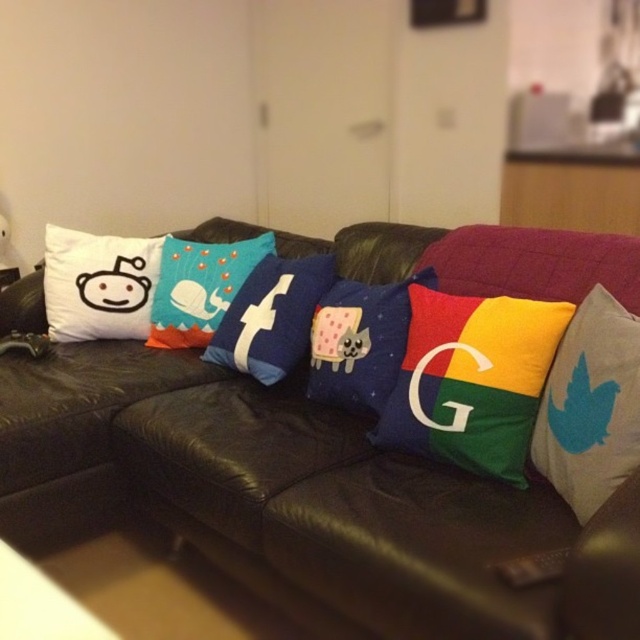
Question: Which of the following is the closest to the observer?

Choices:
 (A) (605, 390)
 (B) (298, 544)
 (C) (77, 316)

Answer: (A)

Question: Is white fabric twitter bird at right above velvet blue cushion with cartoon character at center?

Choices:
 (A) yes
 (B) no

Answer: (B)

Question: Which object is farther from the camera taking this photo?

Choices:
 (A) velvet blue cushion with cartoon character at center
 (B) white fabric pillow with reddit logo at left
 (C) teal fabric whale at center

Answer: (B)

Question: Which point is closer to the camera?

Choices:
 (A) teal fabric whale at center
 (B) velvet google logo at center
 (C) white fabric pillow with reddit logo at left
 (D) white fabric twitter bird at right

Answer: (D)

Question: In this image, where is white fabric twitter bird at right located relative to velvet blue cushion with cartoon character at center?

Choices:
 (A) right
 (B) left

Answer: (A)

Question: Is white fabric pillow with reddit logo at left above blue fabric facebook logo at center?

Choices:
 (A) yes
 (B) no

Answer: (A)